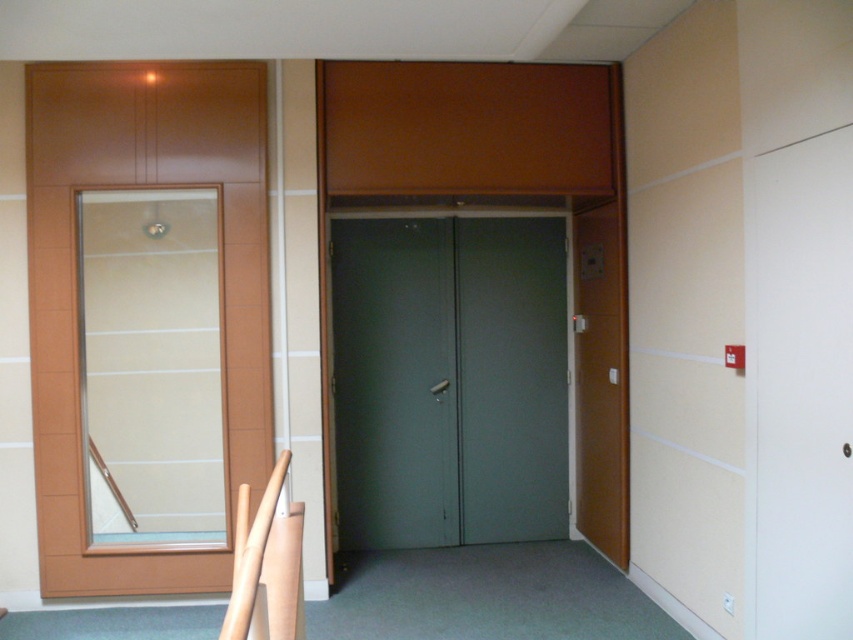
Question: Is transparent glass door at left positioned in front of matte brown door at right?

Choices:
 (A) yes
 (B) no

Answer: (A)

Question: Which point is farther from the camera taking this photo?

Choices:
 (A) (486, 352)
 (B) (412, 364)
 (C) (601, 451)
 (D) (183, 532)

Answer: (A)

Question: Can you confirm if transparent glass door at center is smaller than matte brown door at right?

Choices:
 (A) no
 (B) yes

Answer: (A)

Question: Estimate the real-world distances between objects in this image. Which object is closer to the matte gray door at center?

Choices:
 (A) matte brown door at right
 (B) transparent glass door at left

Answer: (A)

Question: Can you confirm if transparent glass door at left is positioned below matte brown door at right?

Choices:
 (A) no
 (B) yes

Answer: (A)

Question: Considering the real-world distances, which object is closest to the transparent glass door at center?

Choices:
 (A) matte gray door at center
 (B) transparent glass door at left
 (C) matte brown door at right

Answer: (A)